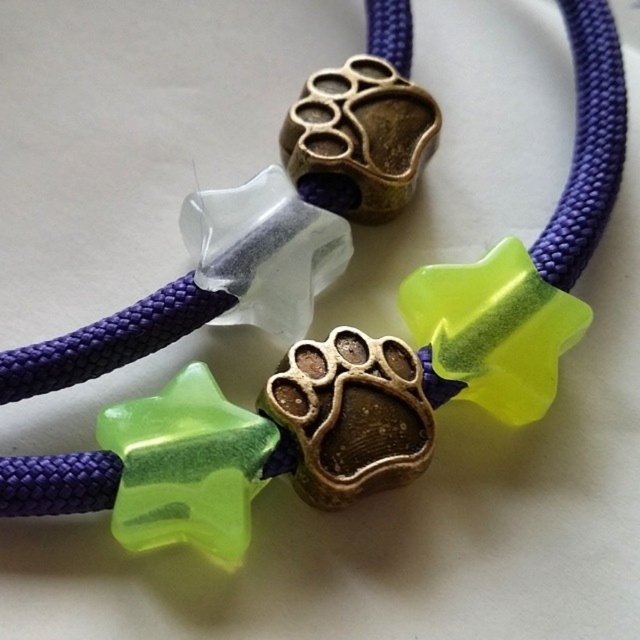
In the scene shown: You are an artisan designing a jewelry piece. You need to place a new bead exactly at the center of the bracelet. The current design has a bronze textured paw print bead at point (349, 416). Where should you place the new bead to ensure it is centered?

The bronze textured paw print bead is already at the center point (349, 416), so placing the new bead at the same coordinates would keep it centered.

You are an artisan examining the bracelet and notice the bronze textured paw print at center and the antique brass paw print at center. Which of these two beads is taller?

The bronze textured paw print at center is much taller than the antique brass paw print at center.

You are examining a piece of jewelry with two points marked on it. Based on their positions, which point is nearer to you, point (362,460) or point (314,88)?

Point (362,460) is closer to the viewer than point (314,88).